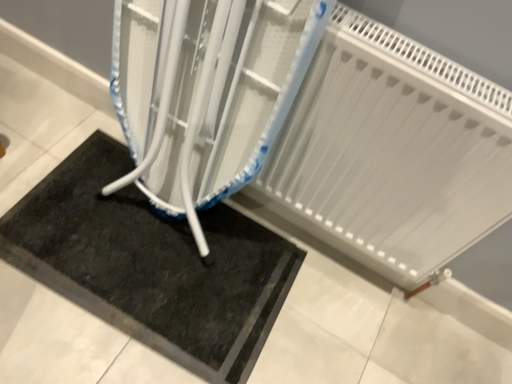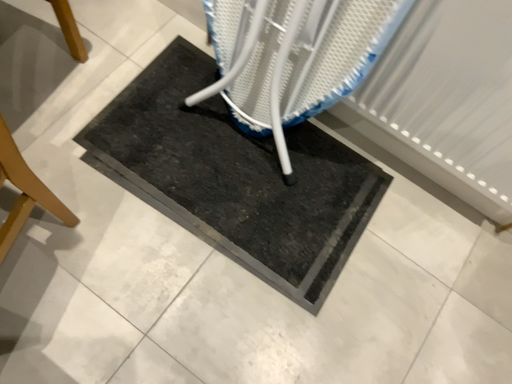
Question: How did the camera likely rotate when shooting the video?

Choices:
 (A) rotated right
 (B) rotated left

Answer: (B)